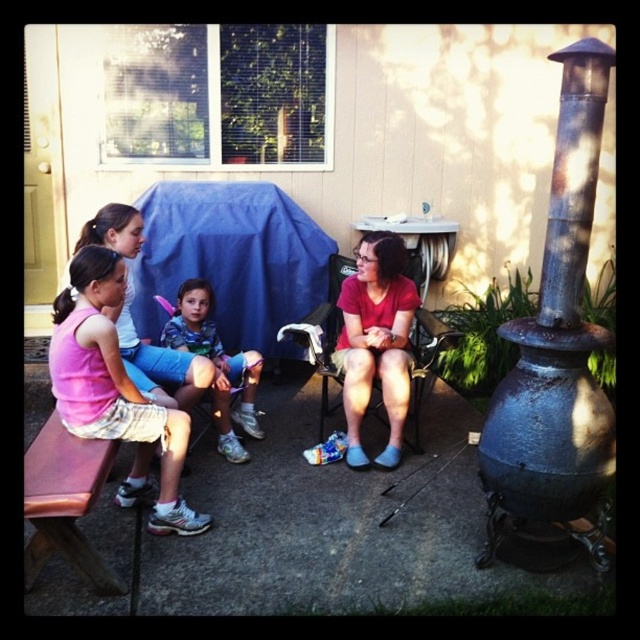
You are standing in the backyard and want to take a photo of the rusty metal chimney at right. If your camera can focus on objects up to 2 meters away, will you need to move closer or farther away to get a clear shot?

The rusty metal chimney at right is 2.14 meters away from the camera. Since the camera can focus up to 2 meters, you need to move closer to ensure it is within the focus range.

Looking at this image, you are a photographer trying to capture a photo of the matte red shirt at center and the brown wooden bench at lower left. Which object should you focus on first if you want to ensure both are in clear view, considering their sizes?

The matte red shirt at center is larger in size than the brown wooden bench at lower left, so you should focus on the matte red shirt at center first to ensure both are in clear view.

What is located at the coordinates point (557, 346)?

The rusty metal chimney at right is located at point (557, 346).